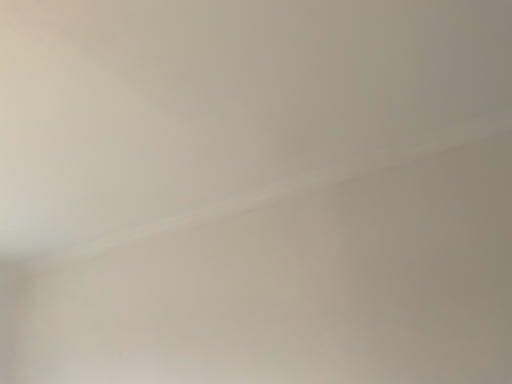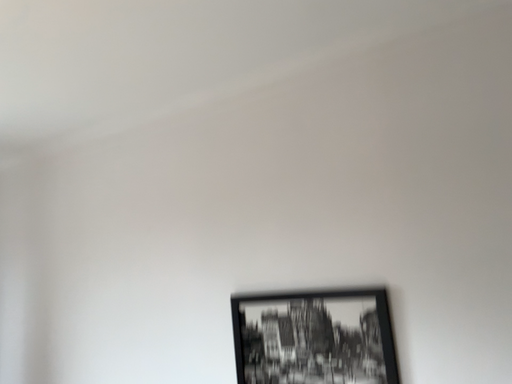
Question: How did the camera likely rotate when shooting the video?

Choices:
 (A) rotated downward
 (B) rotated upward

Answer: (A)